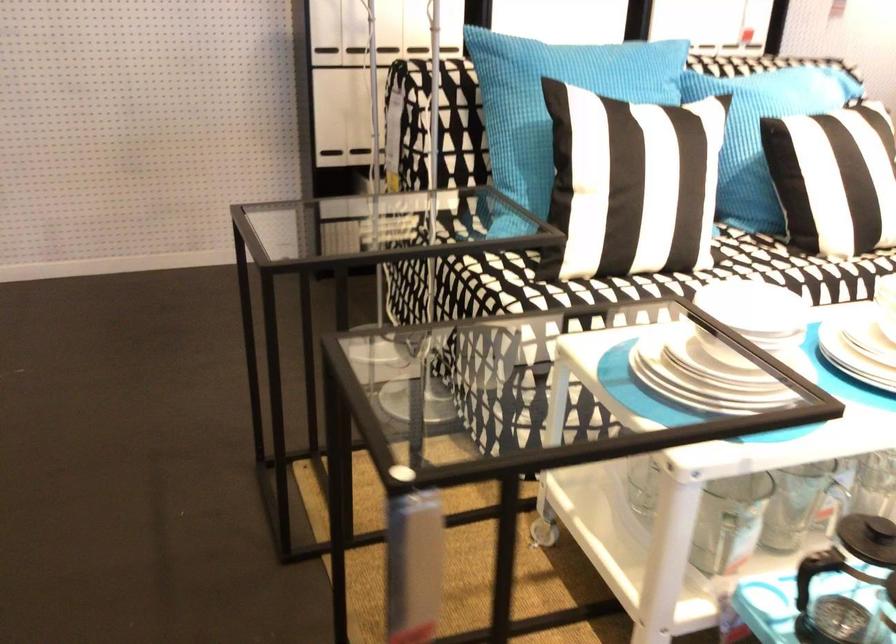
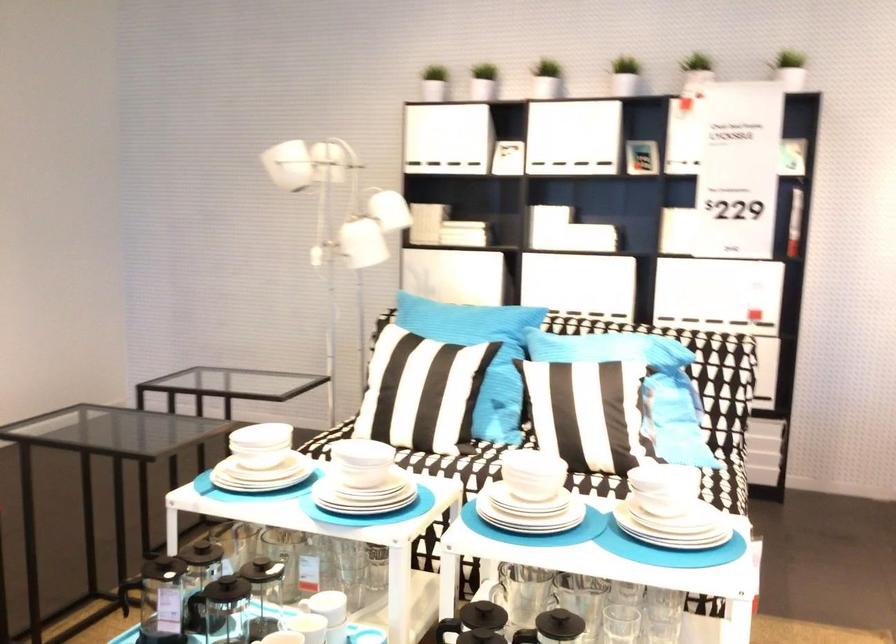
The point at (691, 316) is marked in the first image. Where is the corresponding point in the second image?

(261, 440)